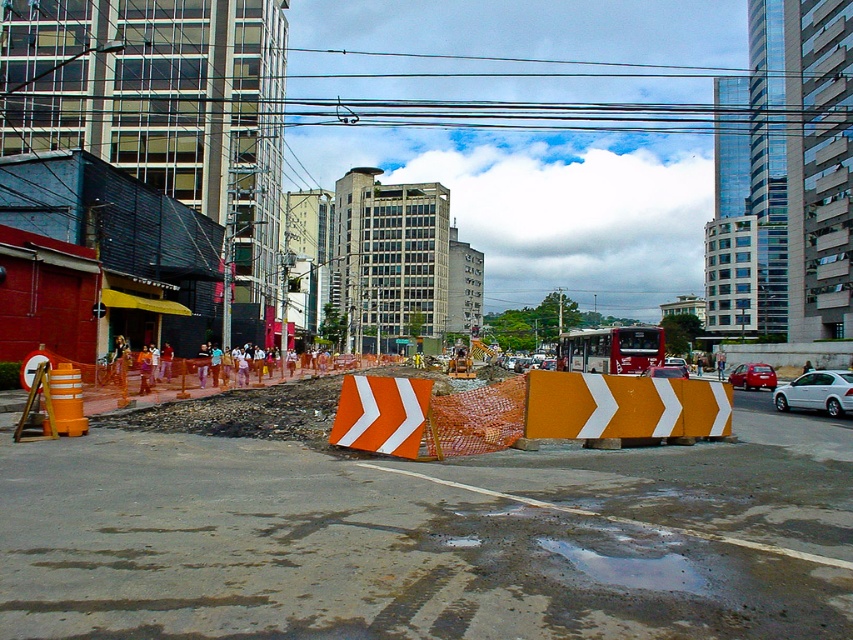
You are a delivery driver who needs to navigate through the construction zone. You see the yellow matte barricade at center and the metallic red sedan at center right. Which object is lower in height?

The yellow matte barricade at center is shorter than the metallic red sedan at center right, so the yellow matte barricade at center is lower in height.